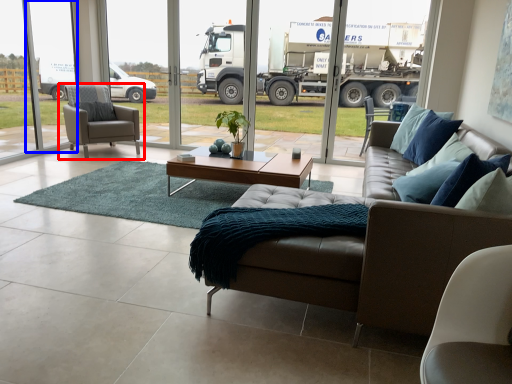
Question: Which object appears closest to the camera in this image, chair (highlighted by a red box) or window screen (highlighted by a blue box)?

Choices:
 (A) chair
 (B) window screen

Answer: (B)